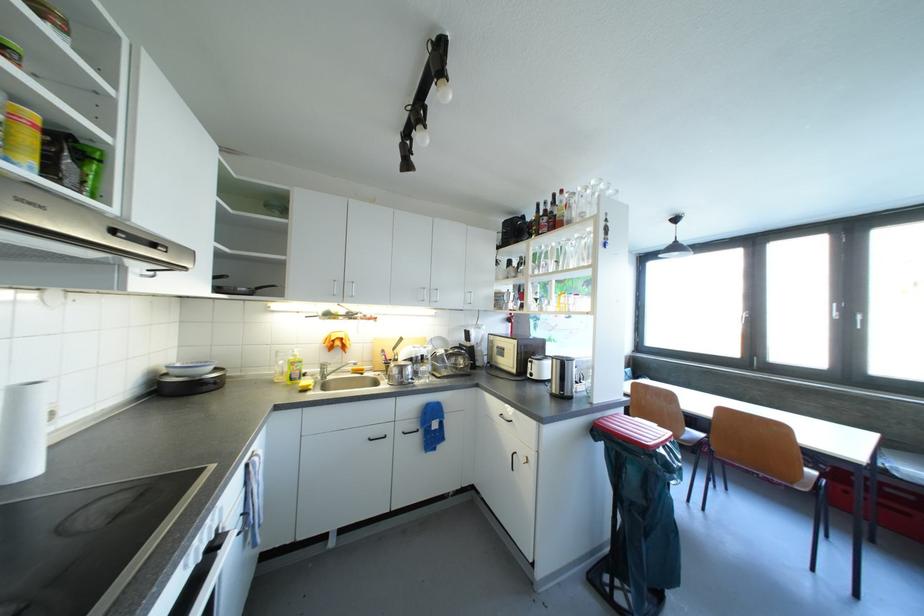
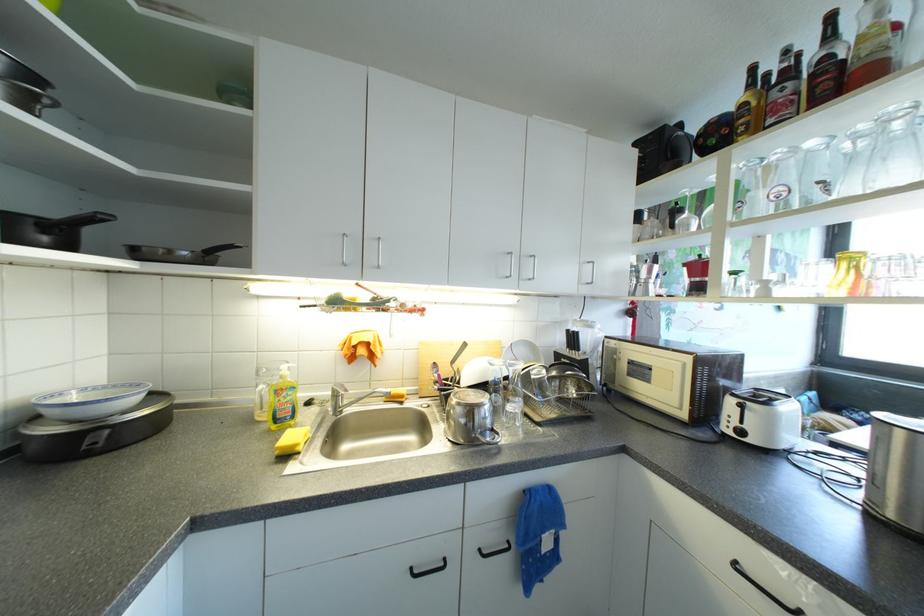
In the second image, find the point that corresponds to the point at 560,246 in the first image.

(818, 146)